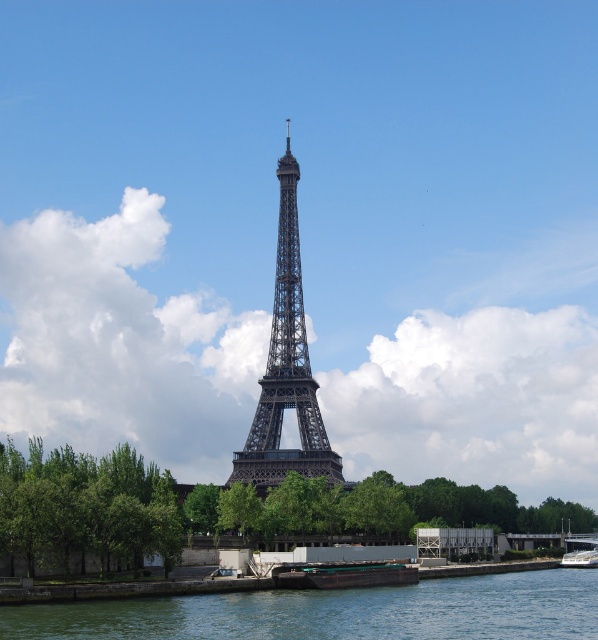
Can you confirm if green leafy tree at lower left is taller than dark gray metal eiffel tower at center?

Incorrect, green leafy tree at lower left's height is not larger of dark gray metal eiffel tower at center's.

Between point (84, 531) and point (289, 195), which one is positioned in front?

Point (84, 531) is more forward.

Where is `green leafy tree at lower left`? This screenshot has width=598, height=640. green leafy tree at lower left is located at coordinates (86, 508).

Between point (154, 477) and point (282, 566), which one is positioned behind?

The point (154, 477) is behind.

Which is below, green leafy tree at lower left or green matte barge at lower center?

green matte barge at lower center is below.

Who is more distant from viewer, (x=2, y=502) or (x=297, y=570)?

Positioned behind is point (x=297, y=570).

At what (x,y) coordinates should I click in order to perform the action: click on green leafy tree at lower left. Please return your answer as a coordinate pair (x, y). This screenshot has height=640, width=598. Looking at the image, I should click on (86, 508).

Is green matte barge at lower center taller than metallic polished boat at lower right?

Indeed, green matte barge at lower center has a greater height compared to metallic polished boat at lower right.

Which is in front, point (344, 563) or point (578, 554)?

Positioned in front is point (344, 563).

Where is `green matte barge at lower center`? The image size is (598, 640). green matte barge at lower center is located at coordinates (344, 573).